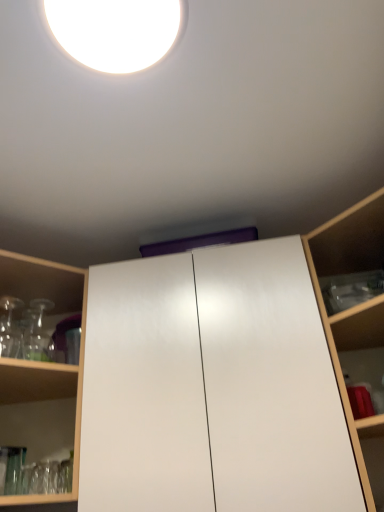
Question: Should I look upward or downward to see white glossy cabinet at center?

Choices:
 (A) up
 (B) down

Answer: (B)

Question: Is transparent glassware at left, arranged as the first shelf when viewed from the left, shorter than wooden shelf at right, the 1th shelf from the right?

Choices:
 (A) no
 (B) yes

Answer: (B)

Question: From a real-world perspective, is transparent glassware at left, arranged as the first shelf when viewed from the left, located higher than wooden shelf at right, the 2th shelf when ordered from left to right?

Choices:
 (A) no
 (B) yes

Answer: (B)

Question: Can you confirm if transparent glassware at left, the second shelf from the right, is positioned to the right of wooden shelf at right, the 1th shelf from the right?

Choices:
 (A) yes
 (B) no

Answer: (B)

Question: Is wooden shelf at right, the 1th shelf from the right, surrounded by transparent glassware at left, the second shelf from the right?

Choices:
 (A) yes
 (B) no

Answer: (B)

Question: Is transparent glassware at left, arranged as the first shelf when viewed from the left, thinner than wooden shelf at right, the 1th shelf from the right?

Choices:
 (A) yes
 (B) no

Answer: (B)

Question: Does transparent glassware at left, arranged as the first shelf when viewed from the left, appear on the left side of wooden shelf at right, the 1th shelf from the right?

Choices:
 (A) yes
 (B) no

Answer: (A)

Question: From a real-world perspective, is transparent glassware at left, arranged as the first shelf when viewed from the left, on top of white glossy droplight at upper center?

Choices:
 (A) no
 (B) yes

Answer: (A)

Question: Would you say transparent glassware at left, arranged as the first shelf when viewed from the left, contains white glossy droplight at upper center?

Choices:
 (A) yes
 (B) no

Answer: (B)

Question: Is white glossy droplight at upper center at the back of transparent glassware at left, arranged as the first shelf when viewed from the left?

Choices:
 (A) no
 (B) yes

Answer: (A)

Question: Is transparent glassware at left, arranged as the first shelf when viewed from the left, wider than white glossy droplight at upper center?

Choices:
 (A) no
 (B) yes

Answer: (B)

Question: From the image's perspective, is transparent glassware at left, arranged as the first shelf when viewed from the left, located beneath white glossy droplight at upper center?

Choices:
 (A) yes
 (B) no

Answer: (A)

Question: Can you confirm if transparent glassware at left, arranged as the first shelf when viewed from the left, is positioned to the left of white glossy droplight at upper center?

Choices:
 (A) no
 (B) yes

Answer: (B)

Question: Considering the relative positions of white glossy droplight at upper center and transparent glassware at left, the second shelf from the right, in the image provided, is white glossy droplight at upper center to the left of transparent glassware at left, the second shelf from the right, from the viewer's perspective?

Choices:
 (A) yes
 (B) no

Answer: (B)